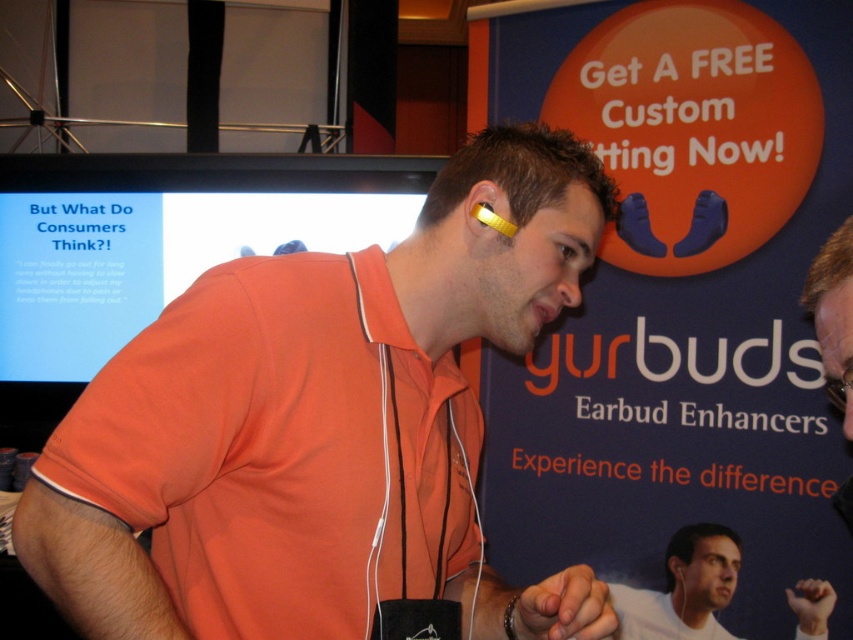
Question: Can you confirm if white matte earbud enhancer at center is thinner than yellow matte earbud enhancer at upper right?

Choices:
 (A) no
 (B) yes

Answer: (A)

Question: Can you confirm if matte black earbud enhancer at upper center is thinner than yellow matte earbud enhancer at upper right?

Choices:
 (A) yes
 (B) no

Answer: (A)

Question: Which of these objects is positioned closest to the matte black screen at upper left?

Choices:
 (A) matte orange shirt at center
 (B) white matte earbud enhancer at center
 (C) matte black earbud enhancer at upper center

Answer: (B)

Question: Among these objects, which one is nearest to the camera?

Choices:
 (A) matte black screen at upper left
 (B) white matte earbud enhancer at center
 (C) matte black earbud enhancer at upper center

Answer: (B)

Question: Is matte black screen at upper left wider than white matte earbud enhancer at center?

Choices:
 (A) no
 (B) yes

Answer: (B)

Question: Which object appears closest to the camera in this image?

Choices:
 (A) white matte earbud enhancer at center
 (B) matte black earbud enhancer at upper center
 (C) yellow matte earbud enhancer at center
 (D) matte black screen at upper left

Answer: (C)